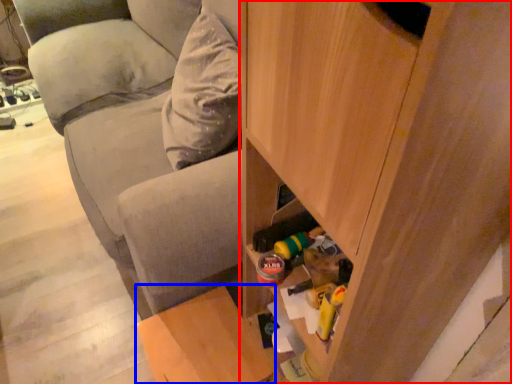
Question: Which object is closer to the camera taking this photo, cabinetry (highlighted by a red box) or furniture (highlighted by a blue box)?

Choices:
 (A) cabinetry
 (B) furniture

Answer: (A)